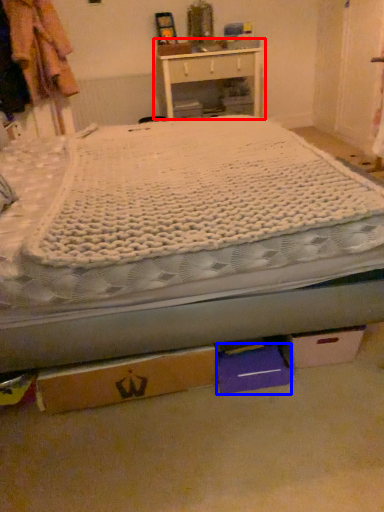
Question: Which object is closer to the camera taking this photo, nightstand (highlighted by a red box) or storage box (highlighted by a blue box)?

Choices:
 (A) nightstand
 (B) storage box

Answer: (B)